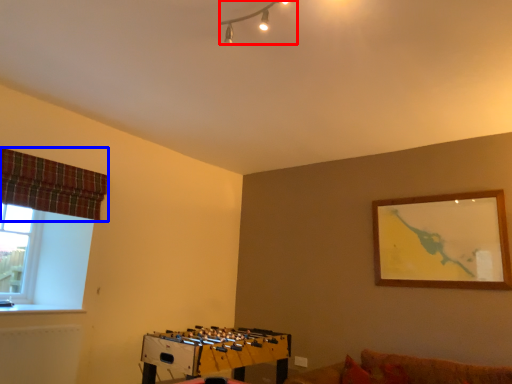
Question: Which object is further to the camera taking this photo, lamp (highlighted by a red box) or curtain (highlighted by a blue box)?

Choices:
 (A) lamp
 (B) curtain

Answer: (B)